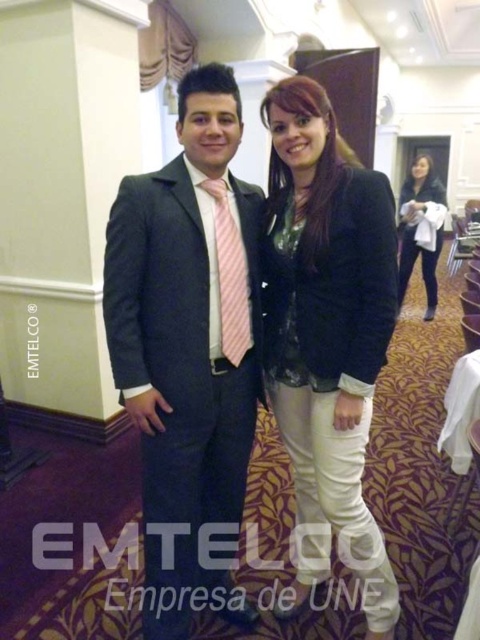
Is matte black suit at center below matte black blazer at center?

Yes, matte black suit at center is below matte black blazer at center.

Is point (192, 556) less distant than point (320, 513)?

That is True.

Which is in front, point (147, 310) or point (316, 476)?

Point (147, 310)

Identify the location of matte black suit at center. This screenshot has width=480, height=640. (188, 340).

Is matte black blazer at center positioned in front of black leather jacket at upper right?

Yes.

Who is lower down, matte black blazer at center or black leather jacket at upper right?

matte black blazer at center is lower down.

Is point (362, 282) positioned behind point (420, 252)?

No, (362, 282) is closer to viewer.

Locate an element on the screen. The height and width of the screenshot is (640, 480). matte black blazer at center is located at coordinates (327, 321).

Is matte black blazer at center to the right of pink striped tie at center from the viewer's perspective?

Indeed, matte black blazer at center is positioned on the right side of pink striped tie at center.

Which is in front, point (339, 182) or point (235, 253)?

Point (339, 182) is in front.

The height and width of the screenshot is (640, 480). Find the location of `matte black blazer at center`. matte black blazer at center is located at coordinates (327, 321).